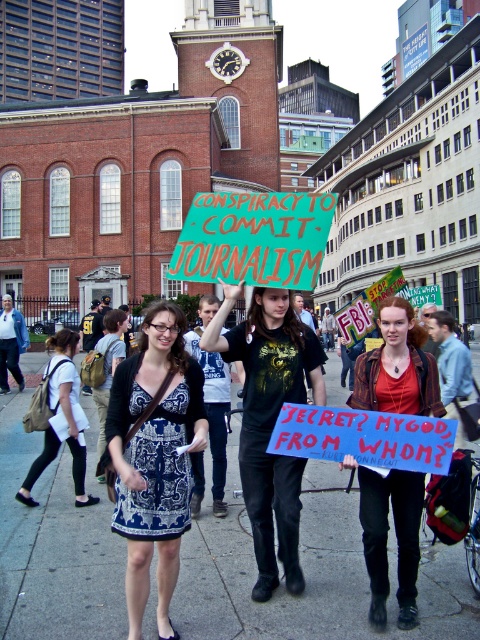
You are a city planner analyzing the protest scene. You need to place a temporary barrier that must be as wide as the gray concrete pavement at center. Can the green fabric sign at center fit entirely on the barrier without overlapping the edges? Explain why or why not.

The gray concrete pavement at center is wider than the green fabric sign at center. Since the barrier will be as wide as the pavement, the green fabric sign at center can fit entirely on the barrier without overlapping the edges because the pavement is wider than the sign.

You are a photographer standing in the middle of the protest scene. You want to take a photo of the gray concrete pavement at center and the green fabric sign at center. Which object appears taller in the photo?

The green fabric sign at center appears taller than the gray concrete pavement at center in the photo because the gray concrete pavement at center is not as tall as the green fabric sign at center.